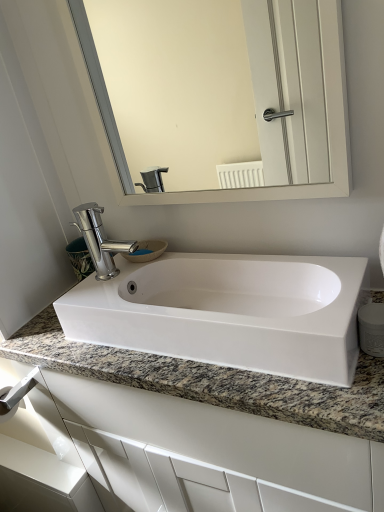
What do you see at coordinates (221, 95) in the screenshot?
I see `white glossy mirror at upper center` at bounding box center [221, 95].

Image resolution: width=384 pixels, height=512 pixels. I want to click on white glossy mirror at upper center, so click(x=221, y=95).

What do you see at coordinates (99, 240) in the screenshot? I see `polished chrome faucet at center` at bounding box center [99, 240].

What do you see at coordinates (211, 380) in the screenshot? I see `granite at center` at bounding box center [211, 380].

Measure the distance between granite at center and camera.

granite at center is 23.20 inches away from camera.

The height and width of the screenshot is (512, 384). What do you see at coordinates (228, 312) in the screenshot?
I see `white glossy sink at center` at bounding box center [228, 312].

You are a GUI agent. You are given a task and a screenshot of the screen. Output one action in this format:
    pyautogui.click(x=<x>, y=<y>)
    Task: Click on the white glossy mirror at upper center
    Image resolution: width=384 pixels, height=512 pixels.
    Given the screenshot: What is the action you would take?
    pyautogui.click(x=221, y=95)

Looking at this image, who is bigger, granite at center or polished chrome faucet at center?

granite at center.

Find the location of a particular element. This screenshot has height=512, width=384. tap above the granite at center (from a real-world perspective) is located at coordinates (99, 240).

In terms of width, does granite at center look wider or thinner when compared to polished chrome faucet at center?

Clearly, granite at center has more width compared to polished chrome faucet at center.

Considering the sizes of white glossy sink at center and satin nickel towel bar at lower left in the image, is white glossy sink at center wider or thinner than satin nickel towel bar at lower left?

Clearly, white glossy sink at center has more width compared to satin nickel towel bar at lower left.

Is satin nickel towel bar at lower left at the back of white glossy sink at center?

No, satin nickel towel bar at lower left is not at the back of white glossy sink at center.

Between white glossy sink at center and satin nickel towel bar at lower left, which one appears on the left side from the viewer's perspective?

From the viewer's perspective, satin nickel towel bar at lower left appears more on the left side.

Can you confirm if polished chrome faucet at center is shorter than granite at center?

Yes.

Is polished chrome faucet at center inside the boundaries of granite at center, or outside?

polished chrome faucet at center is not enclosed by granite at center.

Is polished chrome faucet at center in front of or behind granite at center in the image?

polished chrome faucet at center is behind granite at center.

How many degrees apart are the facing directions of white glossy mirror at upper center and granite at center?

The facing directions of white glossy mirror at upper center and granite at center are 0.000763 degrees apart.

Is white glossy mirror at upper center at the left side of granite at center?

Indeed, white glossy mirror at upper center is positioned on the left side of granite at center.

Which of these two, white glossy mirror at upper center or granite at center, stands shorter?

With less height is white glossy mirror at upper center.

How far apart are white glossy mirror at upper center and white glossy sink at center?

They are 1.19 meters apart.

Can you confirm if white glossy mirror at upper center is smaller than white glossy sink at center?

Yes.

Between white glossy mirror at upper center and white glossy sink at center, which one appears on the left side from the viewer's perspective?

white glossy mirror at upper center.

Considering the positions of point (123, 0) and point (233, 304), is point (123, 0) closer or farther from the camera than point (233, 304)?

Point (123, 0) is positioned farther from the camera compared to point (233, 304).

From a real-world perspective, is white glossy mirror at upper center positioned above or below polished chrome faucet at center?

From a real-world perspective, white glossy mirror at upper center is physically above polished chrome faucet at center.

From the image's perspective, is white glossy mirror at upper center above or below polished chrome faucet at center?

From the image's perspective, white glossy mirror at upper center appears above polished chrome faucet at center.

Does point (196, 114) come behind point (77, 218)?

That is True.

Considering the relative positions of white glossy mirror at upper center and polished chrome faucet at center in the image provided, is white glossy mirror at upper center to the left of polished chrome faucet at center from the viewer's perspective?

No, white glossy mirror at upper center is not to the left of polished chrome faucet at center.

Between white glossy sink at center and white glossy mirror at upper center, which one is positioned in front?

white glossy mirror at upper center is more forward.

From the image's perspective, which one is positioned lower, white glossy sink at center or white glossy mirror at upper center?

white glossy sink at center appears lower in the image.

Is white glossy sink at center completely or partially outside of white glossy mirror at upper center?

white glossy sink at center lies outside white glossy mirror at upper center's area.

How much distance is there between white glossy sink at center and white glossy mirror at upper center?

The distance of white glossy sink at center from white glossy mirror at upper center is 3.90 feet.

Identify the location of tap above the granite at center (from a real-world perspective). (99, 240).

Where is `sink that appears in front of the satin nickel towel bar at lower left`? sink that appears in front of the satin nickel towel bar at lower left is located at coordinates (228, 312).

Considering their positions, is polished chrome faucet at center positioned further to white glossy sink at center than granite at center?

polished chrome faucet at center is further to white glossy sink at center.

Considering their positions, is satin nickel towel bar at lower left positioned closer to white glossy sink at center than white glossy mirror at upper center?

Based on the image, satin nickel towel bar at lower left appears to be nearer to white glossy sink at center.

Looking at the image, which one is located closer to granite at center, white glossy sink at center or white glossy mirror at upper center?

Based on the image, white glossy sink at center appears to be nearer to granite at center.

Looking at the image, which one is located further to polished chrome faucet at center, satin nickel towel bar at lower left or granite at center?

satin nickel towel bar at lower left is further to polished chrome faucet at center.

Estimate the real-world distances between objects in this image. Which object is closer to granite at center, white glossy mirror at upper center or polished chrome faucet at center?

polished chrome faucet at center lies closer to granite at center than the other object.

Estimate the real-world distances between objects in this image. Which object is further from satin nickel towel bar at lower left, polished chrome faucet at center or granite at center?

The object further to satin nickel towel bar at lower left is granite at center.

Looking at the image, which one is located further to white glossy sink at center, satin nickel towel bar at lower left or granite at center?

satin nickel towel bar at lower left is positioned further to the anchor white glossy sink at center.

Based on their spatial positions, is white glossy sink at center or white glossy mirror at upper center closer to satin nickel towel bar at lower left?

white glossy sink at center.

Locate an element on the screen. tap that lies between white glossy mirror at upper center and white glossy sink at center from top to bottom is located at coordinates (99, 240).

Identify the location of towel bar between white glossy mirror at upper center and granite at center in the vertical direction. The width and height of the screenshot is (384, 512). (18, 391).

The height and width of the screenshot is (512, 384). I want to click on sink situated between satin nickel towel bar at lower left and granite at center from left to right, so click(x=228, y=312).

Image resolution: width=384 pixels, height=512 pixels. I want to click on towel bar that lies between polished chrome faucet at center and granite at center from top to bottom, so click(18, 391).